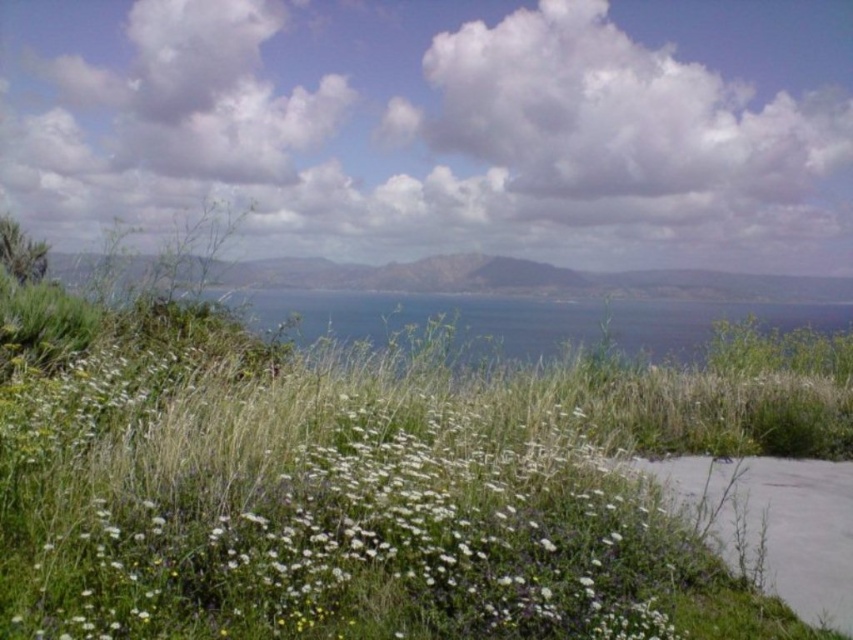
Question: Can you confirm if white fluffy cloud at upper center is thinner than gray concrete path at lower right?

Choices:
 (A) yes
 (B) no

Answer: (B)

Question: Which object appears closest to the camera in this image?

Choices:
 (A) white fluffy flowers at center
 (B) gray concrete path at lower right

Answer: (A)

Question: Which is farther from the white fluffy flowers at center?

Choices:
 (A) gray concrete path at lower right
 (B) white fluffy cloud at upper center

Answer: (B)

Question: Which object is the farthest from the gray concrete path at lower right?

Choices:
 (A) white fluffy flowers at center
 (B) white fluffy cloud at upper center

Answer: (B)

Question: Is white fluffy cloud at upper center above gray concrete path at lower right?

Choices:
 (A) yes
 (B) no

Answer: (A)

Question: Does white fluffy cloud at upper center appear under white fluffy flowers at center?

Choices:
 (A) no
 (B) yes

Answer: (A)